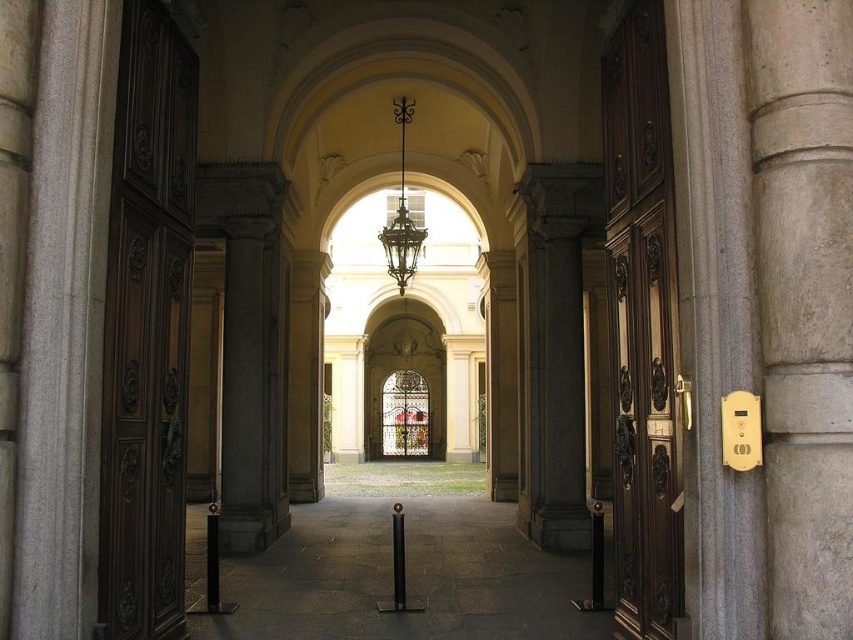
Which of these two, dark wood door at left or polished dark wood door at right, stands shorter?

With less height is dark wood door at left.

Can you confirm if dark wood door at left is taller than polished dark wood door at right?

In fact, dark wood door at left may be shorter than polished dark wood door at right.

At what (x,y) coordinates should I click in order to perform the action: click on dark wood door at left. Please return your answer as a coordinate pair (x, y). Image resolution: width=853 pixels, height=640 pixels. Looking at the image, I should click on (148, 330).

Does polished dark wood door at right have a greater height compared to metallic wrought iron chandelier at center?

No.

Can you confirm if polished dark wood door at right is positioned to the right of metallic wrought iron chandelier at center?

Correct, you'll find polished dark wood door at right to the right of metallic wrought iron chandelier at center.

Who is more distant from viewer, (611, 204) or (401, 284)?

Point (401, 284)

This screenshot has height=640, width=853. In order to click on polished dark wood door at right in this screenshot , I will do `click(642, 324)`.

Which is behind, point (128, 572) or point (403, 268)?

Positioned behind is point (403, 268).

What do you see at coordinates (148, 330) in the screenshot?
I see `dark wood door at left` at bounding box center [148, 330].

The height and width of the screenshot is (640, 853). What are the coordinates of `dark wood door at left` in the screenshot? It's located at (148, 330).